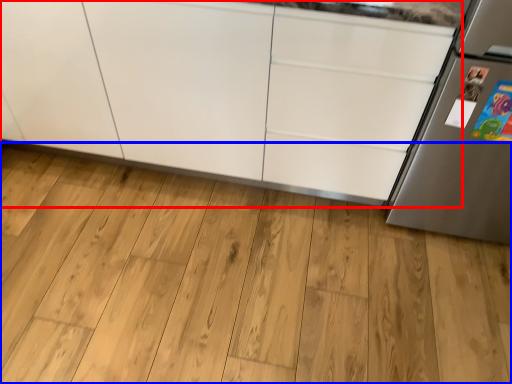
Question: Among these objects, which one is nearest to the camera, cabinetry (highlighted by a red box) or hardwood (highlighted by a blue box)?

Choices:
 (A) cabinetry
 (B) hardwood

Answer: (A)